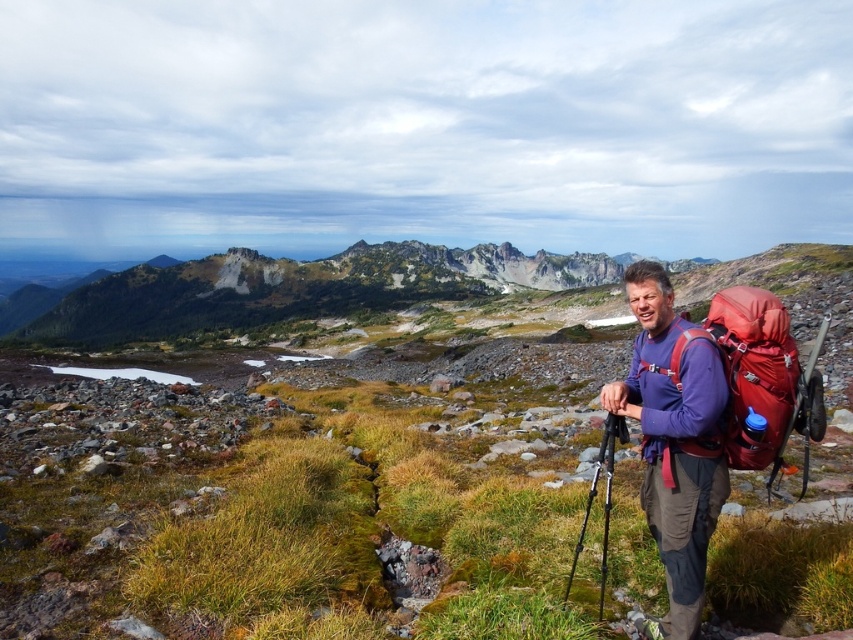
Who is lower down, green grass at center or black metal tripod at center?

black metal tripod at center is below.

Image resolution: width=853 pixels, height=640 pixels. What do you see at coordinates (302, 500) in the screenshot? I see `green grass at center` at bounding box center [302, 500].

Is point (653, 550) behind point (608, 429)?

Yes, it is behind point (608, 429).

At what (x,y) coordinates should I click in order to perform the action: click on green grass at center. Please return your answer as a coordinate pair (x, y). Looking at the image, I should click on (302, 500).

Does green grass at center come in front of matte red backpack at right?

No, green grass at center is behind matte red backpack at right.

Between point (138, 432) and point (808, 422), which one is positioned behind?

Point (138, 432)

Where is `green grass at center`? This screenshot has width=853, height=640. green grass at center is located at coordinates (302, 500).

Who is more distant from viewer, (751, 288) or (585, 516)?

The point (751, 288) is more distant.

How much distance is there between matte red backpack at right and black metal tripod at center?

They are 24.63 feet apart.

Is point (778, 458) positioned after point (564, 598)?

No, it is not.

Where is `matte red backpack at right`? matte red backpack at right is located at coordinates (759, 376).